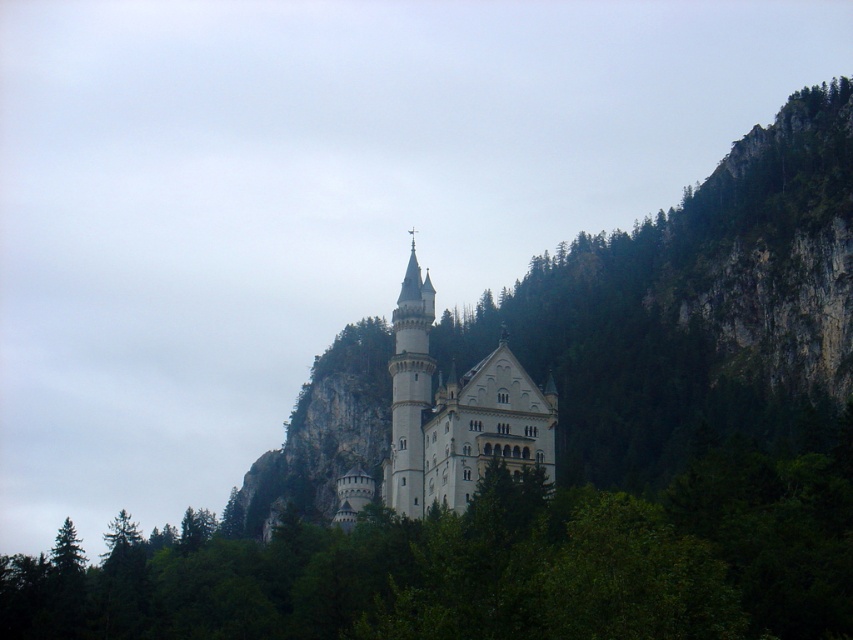
Question: Which is farther from the white stone tower at center?

Choices:
 (A) green leafy tree at center
 (B) white stone castle at center

Answer: (A)

Question: Which point appears closest to the camera in this image?

Choices:
 (A) (743, 508)
 (B) (415, 349)
 (C) (479, 472)

Answer: (A)

Question: Does green leafy tree at center have a greater width compared to white stone tower at center?

Choices:
 (A) yes
 (B) no

Answer: (A)

Question: Observing the image, what is the correct spatial positioning of green leafy tree at center in reference to white stone castle at center?

Choices:
 (A) above
 (B) below

Answer: (B)

Question: Is green leafy tree at center to the left of white stone tower at center from the viewer's perspective?

Choices:
 (A) yes
 (B) no

Answer: (A)

Question: Which object appears closest to the camera in this image?

Choices:
 (A) white stone castle at center
 (B) green leafy tree at center
 (C) white stone tower at center

Answer: (B)